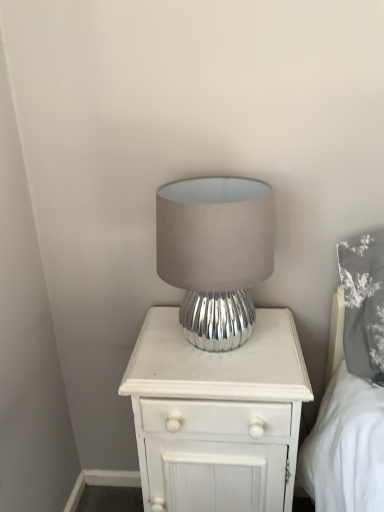
Question: Considering the positions of point (266, 215) and point (177, 409), is point (266, 215) closer or farther from the camera than point (177, 409)?

Choices:
 (A) farther
 (B) closer

Answer: (B)

Question: In terms of height, does silver metallic lamp at center look taller or shorter compared to white wood nightstand at center?

Choices:
 (A) tall
 (B) short

Answer: (B)

Question: From a real-world perspective, is silver metallic lamp at center physically located above or below white wood nightstand at center?

Choices:
 (A) below
 (B) above

Answer: (B)

Question: From the image's perspective, is white wood nightstand at center located above or below silver metallic lamp at center?

Choices:
 (A) above
 (B) below

Answer: (B)

Question: From their relative heights in the image, would you say white wood nightstand at center is taller or shorter than silver metallic lamp at center?

Choices:
 (A) short
 (B) tall

Answer: (B)

Question: Considering the relative positions of white wood nightstand at center and silver metallic lamp at center in the image provided, is white wood nightstand at center to the left or to the right of silver metallic lamp at center?

Choices:
 (A) left
 (B) right

Answer: (B)

Question: Considering the positions of white wood nightstand at center and silver metallic lamp at center in the image, is white wood nightstand at center bigger or smaller than silver metallic lamp at center?

Choices:
 (A) small
 (B) big

Answer: (B)